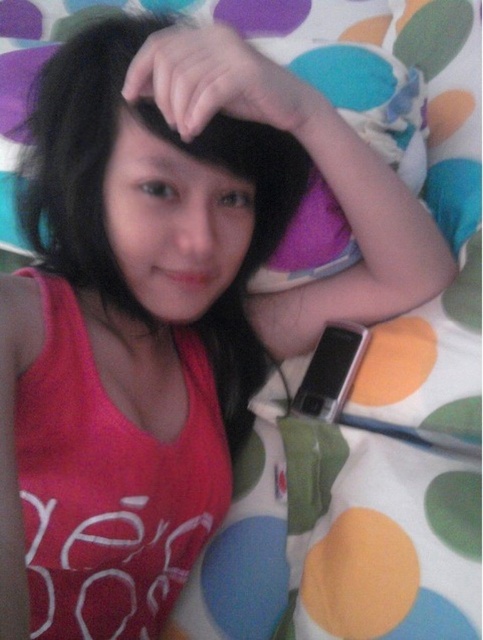
Question: Does black matte hair at center have a lesser width compared to sleek silver phone at lower right?

Choices:
 (A) yes
 (B) no

Answer: (B)

Question: Among these objects, which one is farthest from the camera?

Choices:
 (A) sleek silver phone at lower right
 (B) black matte hair at center

Answer: (A)

Question: Which of the following is the farthest from the observer?

Choices:
 (A) sleek silver phone at lower right
 (B) black matte hair at center

Answer: (A)

Question: Is black matte hair at center below sleek silver phone at lower right?

Choices:
 (A) no
 (B) yes

Answer: (A)

Question: Does black matte hair at center come behind sleek silver phone at lower right?

Choices:
 (A) yes
 (B) no

Answer: (B)

Question: Which of the following is the farthest from the observer?

Choices:
 (A) (288, 209)
 (B) (327, 417)

Answer: (B)